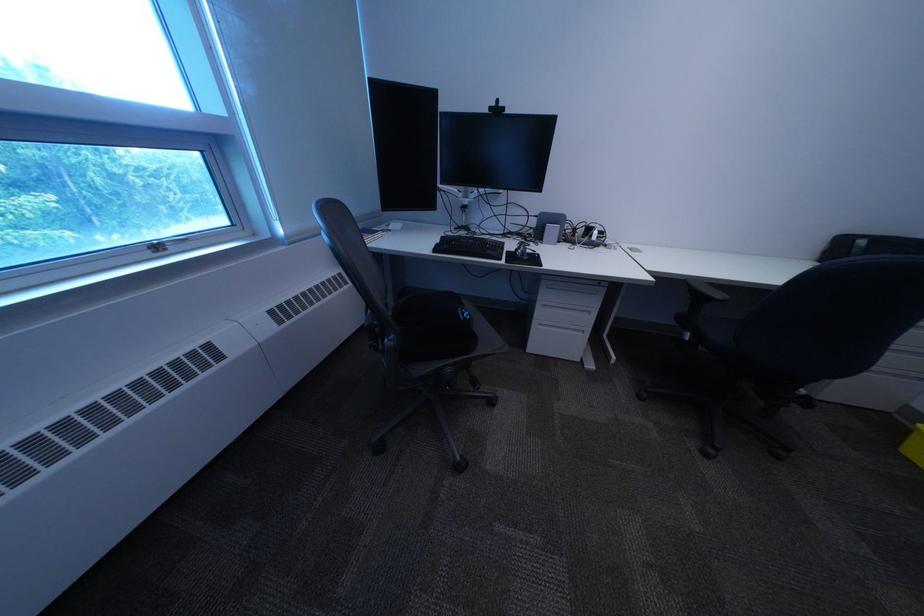
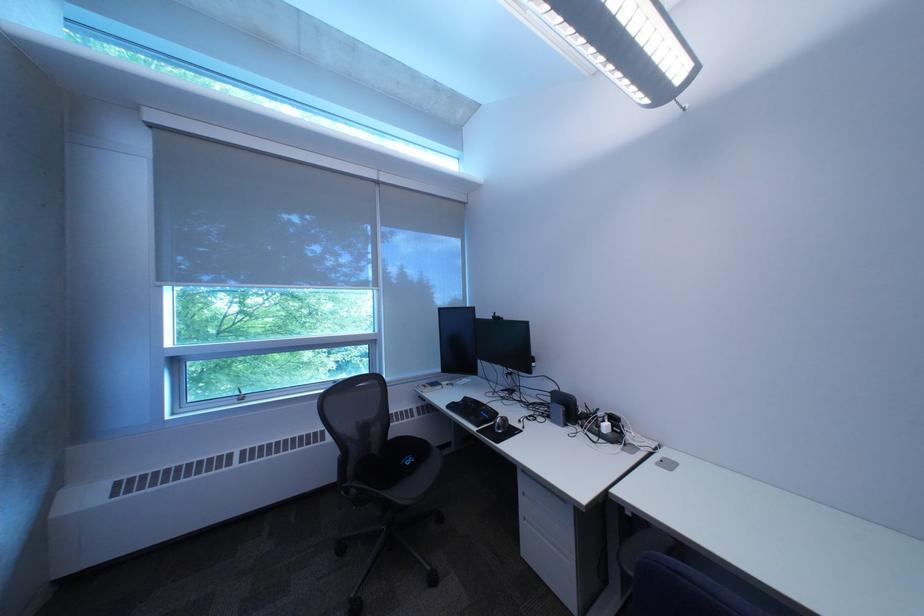
Locate, in the second image, the point that corresponds to (516,262) in the first image.

(492, 429)